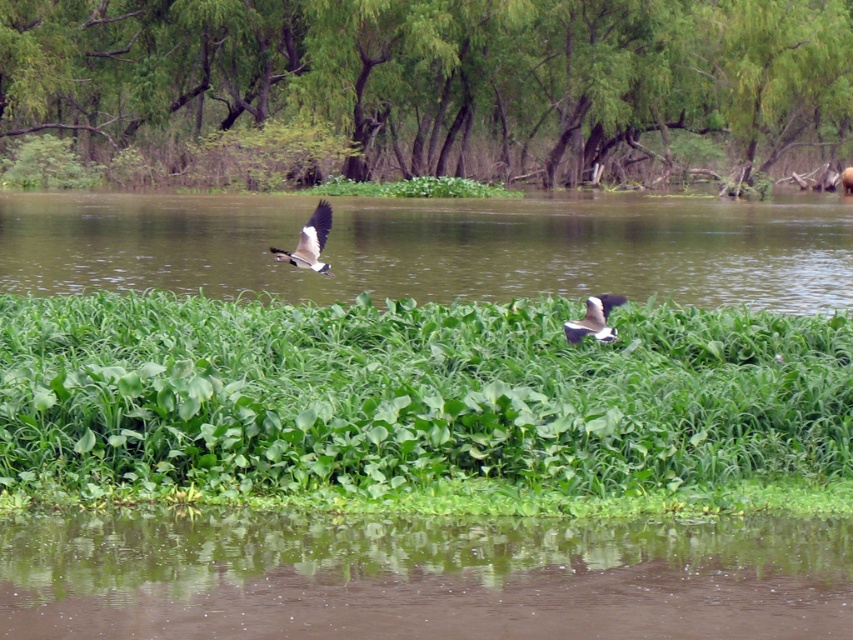
Does point (9, 298) lie in front of point (309, 227)?

No, (9, 298) is further to viewer.

This screenshot has height=640, width=853. Find the location of `green leafy grass at center`. green leafy grass at center is located at coordinates (410, 396).

Is the position of green leafy trees at upper center less distant than that of brown reflective water at center?

No, it is not.

Does green leafy trees at upper center have a lesser width compared to brown reflective water at center?

No, green leafy trees at upper center is not thinner than brown reflective water at center.

Describe the element at coordinates (426, 92) in the screenshot. I see `green leafy trees at upper center` at that location.

Locate an element on the screen. green leafy trees at upper center is located at coordinates (426, 92).

Does brown reflective water at center lie in front of green leafy vegetation at center?

Yes, brown reflective water at center is closer to the viewer.

Is point (465, 605) closer to camera compared to point (332, 284)?

Yes, point (465, 605) is closer to viewer.

Image resolution: width=853 pixels, height=640 pixels. I want to click on brown reflective water at center, so click(421, 577).